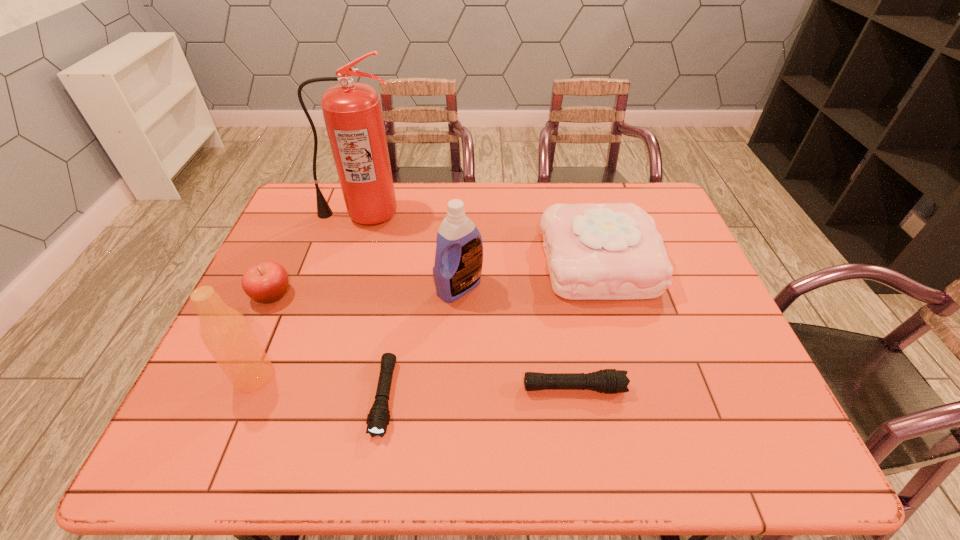
Where is `free space that satisfies the following two spatial constraints: 1. on the back side of the detergent; 2. on the left side of the fourth shortest object`? This screenshot has height=540, width=960. free space that satisfies the following two spatial constraints: 1. on the back side of the detergent; 2. on the left side of the fourth shortest object is located at coordinates (461, 262).

This screenshot has height=540, width=960. What are the coordinates of `vacant space that satisfies the following two spatial constraints: 1. on the instruction side of the detergent; 2. on the left side of the tallest object` in the screenshot? It's located at (339, 287).

In order to click on vacant position in the image that satisfies the following two spatial constraints: 1. on the instruction side of the fifth object from left to right; 2. on the right side of the fire extinguisher in this screenshot , I will do `click(339, 287)`.

Identify the location of free space that satisfies the following two spatial constraints: 1. on the instruction side of the cake; 2. on the right side of the tallest object. The image size is (960, 540). (347, 262).

Where is `vacant region that satisfies the following two spatial constraints: 1. on the instruction side of the tallest object; 2. on the right side of the third object from right to left`? This screenshot has width=960, height=540. vacant region that satisfies the following two spatial constraints: 1. on the instruction side of the tallest object; 2. on the right side of the third object from right to left is located at coordinates [339, 287].